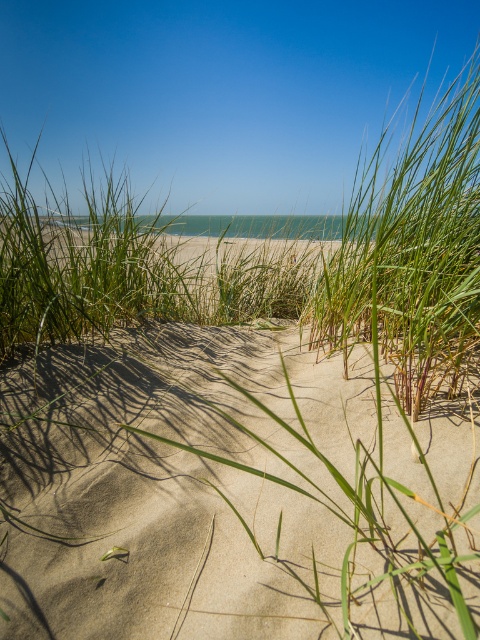
Which of these two, sandy beige sand at center or green grass at center, stands taller?

With more height is green grass at center.

Is sandy beige sand at center in front of green grass at center?

Yes, it is in front of green grass at center.

What do you see at coordinates (230, 493) in the screenshot? I see `sandy beige sand at center` at bounding box center [230, 493].

Image resolution: width=480 pixels, height=640 pixels. In order to click on sandy beige sand at center in this screenshot , I will do pyautogui.click(x=230, y=493).